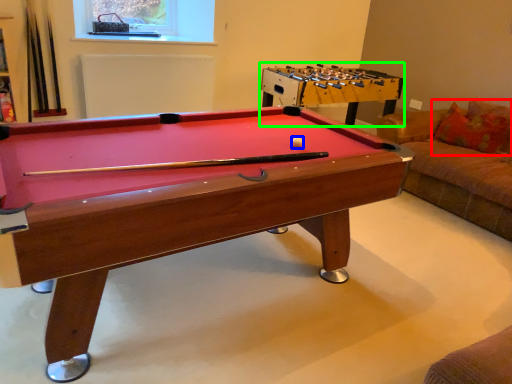
Question: Which is farther away from pillow (highlighted by a red box)? ball (highlighted by a blue box) or table (highlighted by a green box)?

Choices:
 (A) ball
 (B) table

Answer: (A)